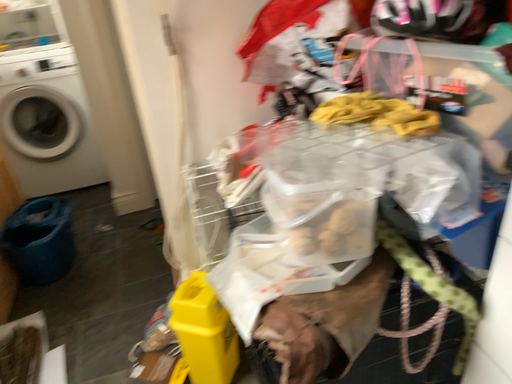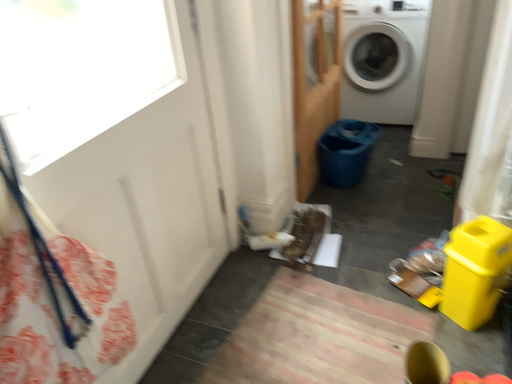
Question: Which way did the camera rotate in the video?

Choices:
 (A) rotated left
 (B) rotated right

Answer: (A)